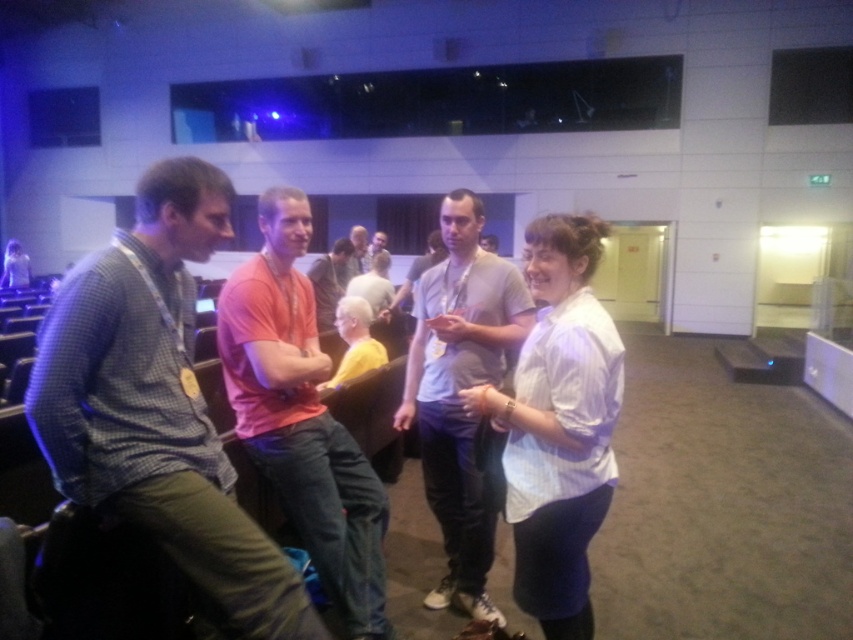
What do you see at coordinates (457, 396) in the screenshot?
I see `light gray cotton shirt at center` at bounding box center [457, 396].

Consider the image. Is light gray cotton shirt at center below matte gray shirt at center?

Yes, light gray cotton shirt at center is below matte gray shirt at center.

The width and height of the screenshot is (853, 640). I want to click on light gray cotton shirt at center, so click(457, 396).

Can you confirm if light gray cotton shirt at center is smaller than matte orange shirt at center?

Yes.

The height and width of the screenshot is (640, 853). Describe the element at coordinates (457, 396) in the screenshot. I see `light gray cotton shirt at center` at that location.

Does point (486, 342) come behind point (370, 240)?

No, it is in front of (370, 240).

Identify the location of light gray cotton shirt at center. The image size is (853, 640). (457, 396).

Who is shorter, checkered fabric shirt at left or light gray cotton shirt at center?

With less height is checkered fabric shirt at left.

Is checkered fabric shirt at left smaller than light gray cotton shirt at center?

Indeed, checkered fabric shirt at left has a smaller size compared to light gray cotton shirt at center.

What do you see at coordinates (157, 406) in the screenshot? I see `checkered fabric shirt at left` at bounding box center [157, 406].

Locate an element on the screen. The height and width of the screenshot is (640, 853). checkered fabric shirt at left is located at coordinates (157, 406).